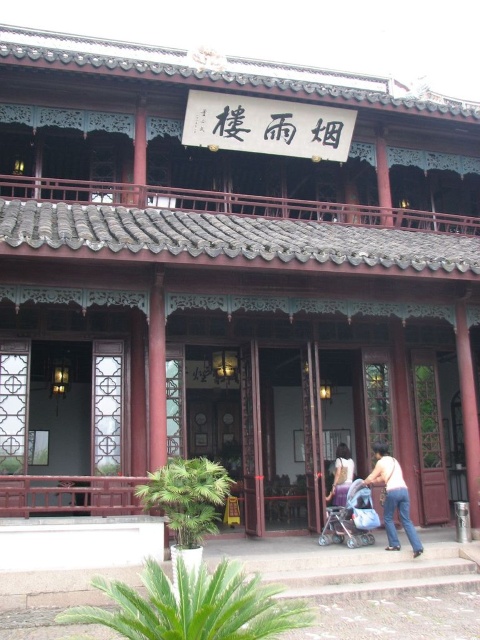
You are visiting this traditional Chinese pavilion and notice two items at the center of the scene. Which one is bigger between the jeans at center and the blue fabric baby carriage at center?

The jeans at center is larger in size than the blue fabric baby carriage at center.

You are standing in front of the traditional Chinese pavilion and notice an object at the center. What is the exact location of the jeans at center in the image?

The jeans at center is located at point coordinates of (393, 497).